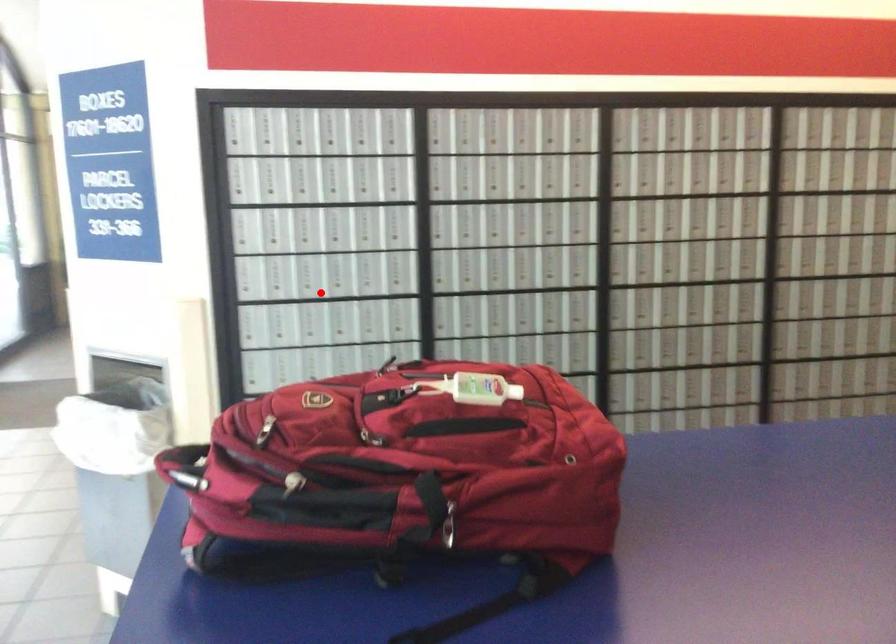
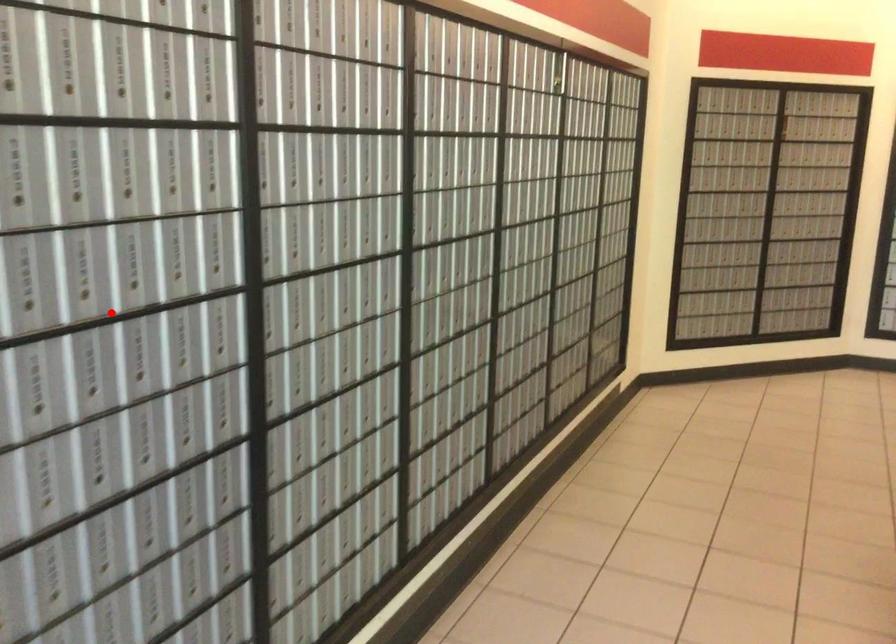
I am providing you with two images of the same scene from different viewpoints. A red point is marked on the first image and another point is marked on the second image. Does the point marked in image1 correspond to the same location as the one in image2?

Yes